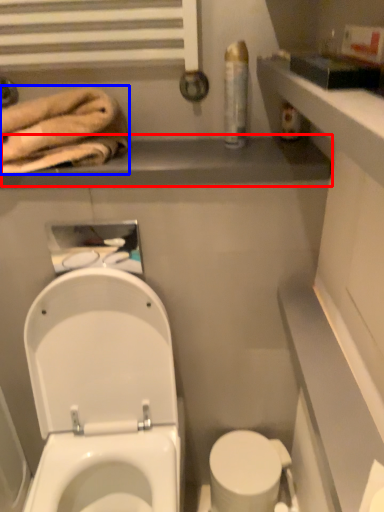
Question: Which of the following is the closest to the observer, balustrade (highlighted by a red box) or bath towel (highlighted by a blue box)?

Choices:
 (A) balustrade
 (B) bath towel

Answer: (B)